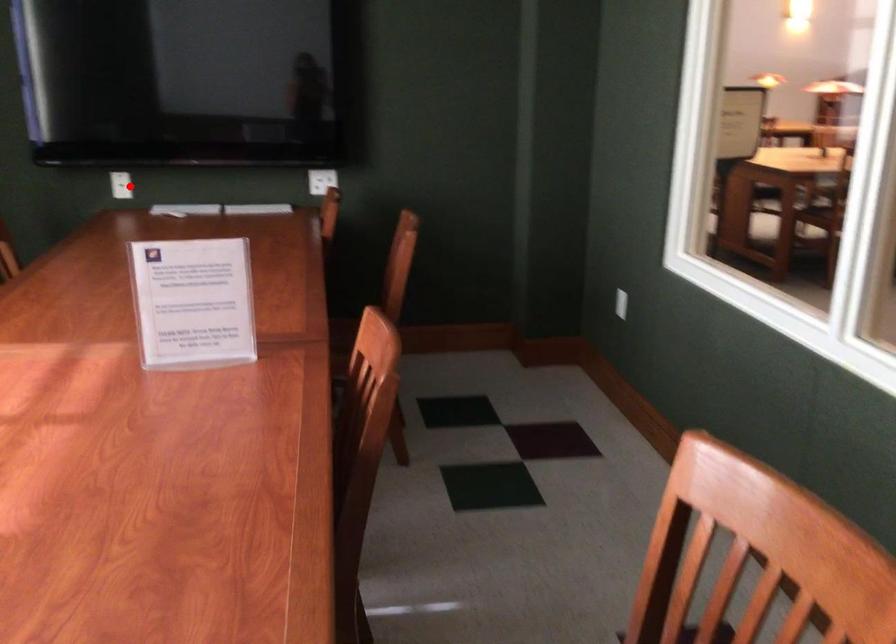
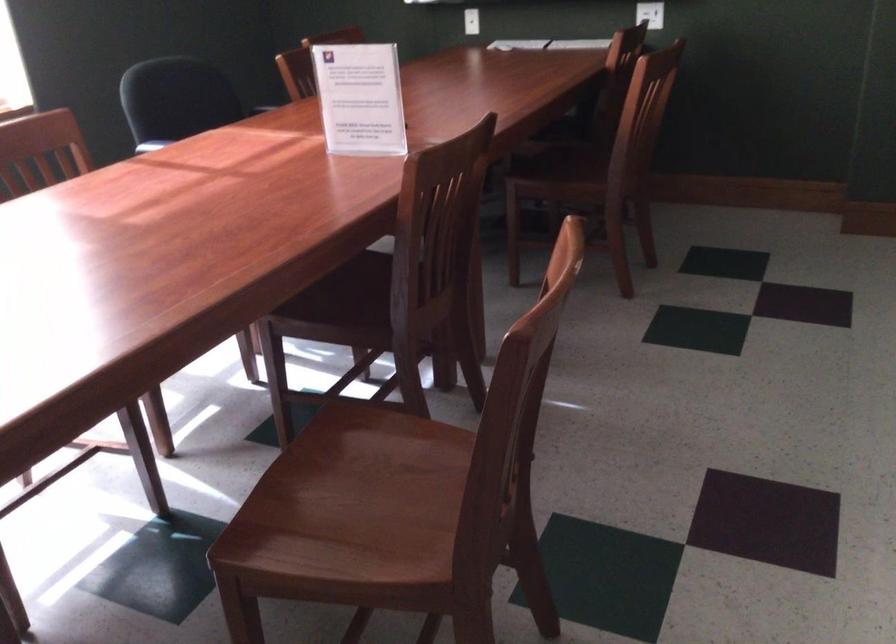
Question: I am providing you with two images of the same scene from different viewpoints. Given a red point in image1, look at the same physical point in image2. Is it:

Choices:
 (A) Closer to the viewpoint
 (B) Farther from the viewpoint

Answer: (B)